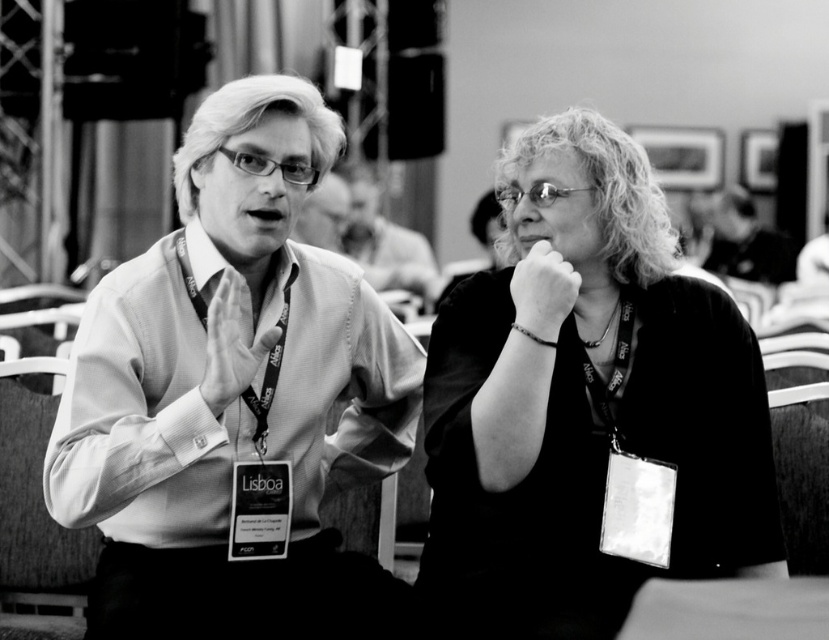
Which is below, matte black shirt at center or matte white shirt at center?

matte black shirt at center is below.

Which is in front, point (715, 522) or point (340, 221)?

Point (715, 522)

At what (x,y) coordinates should I click in order to perform the action: click on matte black shirt at center. Please return your answer as a coordinate pair (x, y). This screenshot has width=829, height=640. Looking at the image, I should click on (585, 406).

From the picture: Who is higher up, matte black shirt at center or smooth black hair at upper right?

smooth black hair at upper right

Which is behind, point (578, 552) or point (742, 253)?

The point (742, 253) is more distant.

The image size is (829, 640). What are the coordinates of `matte black shirt at center` in the screenshot? It's located at (585, 406).

Find the location of a particular element. matte black shirt at center is located at coordinates (585, 406).

Is smooth skin face at center to the right of matte white shirt at center from the viewer's perspective?

Yes, smooth skin face at center is to the right of matte white shirt at center.

Does smooth skin face at center have a greater width compared to matte white shirt at center?

Indeed, smooth skin face at center has a greater width compared to matte white shirt at center.

The width and height of the screenshot is (829, 640). In order to click on smooth skin face at center in this screenshot , I will do `click(385, 241)`.

Identify the location of smooth skin face at center. The width and height of the screenshot is (829, 640). (385, 241).